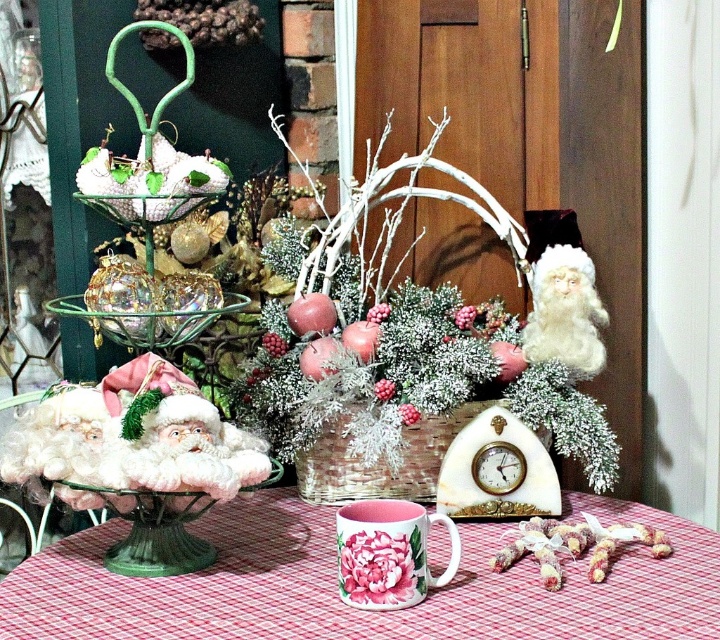
Looking at this image, is frosted white basket at center to the right of pink ceramic mug at lower center from the viewer's perspective?

Yes, frosted white basket at center is to the right of pink ceramic mug at lower center.

Who is higher up, frosted white basket at center or pink ceramic mug at lower center?

Positioned higher is frosted white basket at center.

Between point (431, 161) and point (54, 627), which one is positioned behind?

The point (431, 161) is more distant.

The width and height of the screenshot is (720, 640). I want to click on frosted white basket at center, so click(409, 349).

Between pink ceramic mug at lower center and white marble clock at center, which one is positioned lower?

Positioned lower is pink ceramic mug at lower center.

This screenshot has height=640, width=720. What are the coordinates of `pink ceramic mug at lower center` in the screenshot? It's located at (351, 608).

Between frosted white basket at center and white fluffy santa at right, which one has less height?

white fluffy santa at right

I want to click on frosted white basket at center, so click(x=409, y=349).

The image size is (720, 640). In order to click on frosted white basket at center in this screenshot , I will do `click(409, 349)`.